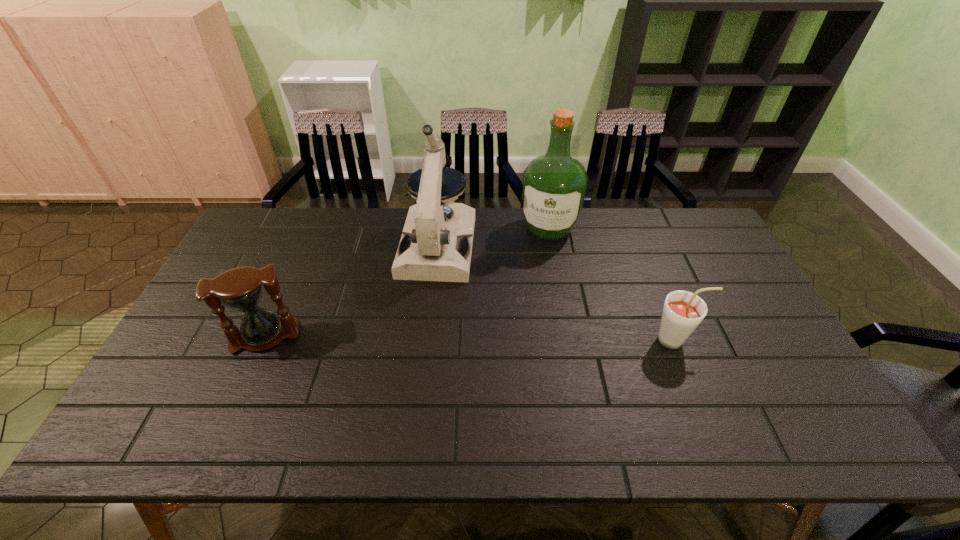
The height and width of the screenshot is (540, 960). Identify the location of free spot on the desktop that is between the hourglass and the root beer and is positioned at the eyepiece of the microscope. (420, 338).

Find the location of a particular element. vacant space on the desktop that is between the second shortest object and the root beer and is positioned on the front-facing side of the liquor is located at coordinates (527, 339).